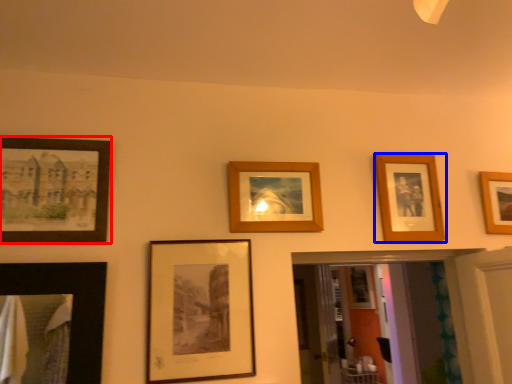
Question: Which object is closer to the camera taking this photo, picture frame (highlighted by a red box) or picture frame (highlighted by a blue box)?

Choices:
 (A) picture frame
 (B) picture frame

Answer: (A)